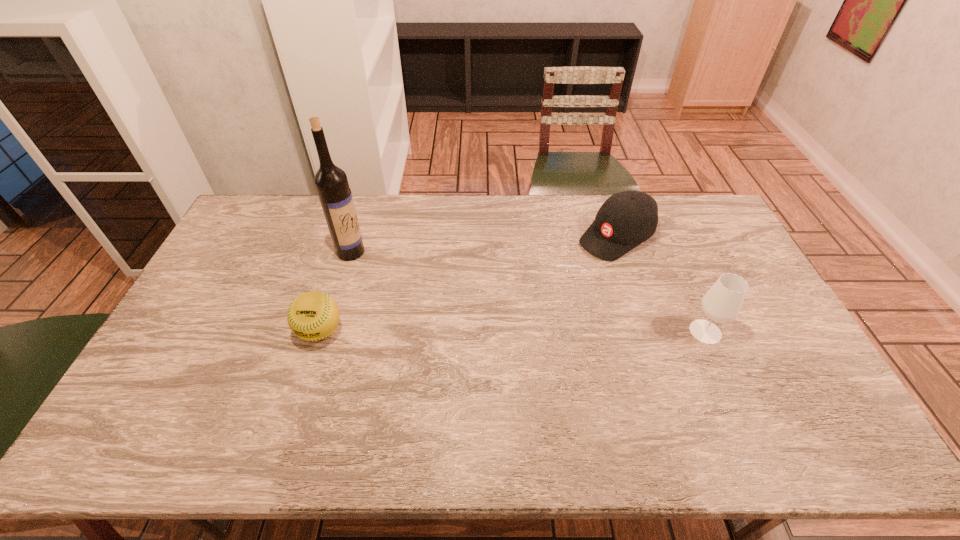
Image resolution: width=960 pixels, height=540 pixels. In order to click on vacant space that's between the glass and the tallest object in this screenshot , I will do `click(528, 292)`.

Where is `free space between the softball and the baseball cap`? free space between the softball and the baseball cap is located at coordinates (468, 284).

At what (x,y) coordinates should I click in order to perform the action: click on free space that is in between the wine bottle and the baseball cap. Please return your answer as a coordinate pair (x, y). Looking at the image, I should click on pos(484,244).

At what (x,y) coordinates should I click in order to perform the action: click on free space between the softball and the baseball cap. Please return your answer as a coordinate pair (x, y). This screenshot has width=960, height=540. Looking at the image, I should click on (468, 284).

Image resolution: width=960 pixels, height=540 pixels. Find the location of `vacant space that is in between the third shortest object and the softball`. vacant space that is in between the third shortest object and the softball is located at coordinates (513, 332).

Where is `free spot between the baseball cap and the softball`? The width and height of the screenshot is (960, 540). free spot between the baseball cap and the softball is located at coordinates (468, 284).

Locate an element on the screen. The width and height of the screenshot is (960, 540). vacant region between the baseball cap and the softball is located at coordinates (468, 284).

Where is `free space between the baseball cap and the softball`? Image resolution: width=960 pixels, height=540 pixels. free space between the baseball cap and the softball is located at coordinates pyautogui.click(x=468, y=284).

Choose which object is the nearest neighbor to the second tallest object. Please provide its 2D coordinates. Your answer should be formatted as a tuple, i.e. [(x, y)], where the tuple contains the x and y coordinates of a point satisfying the conditions above.

[(626, 219)]

The height and width of the screenshot is (540, 960). I want to click on object that is the closest one to the baseball cap, so click(722, 303).